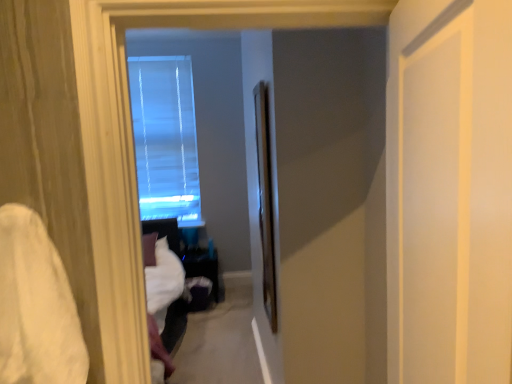
Question: Would you say white soft fabric at left is inside or outside clear glass screen door at center, acting as the 2th screen door starting from the right?

Choices:
 (A) outside
 (B) inside

Answer: (A)

Question: From a real-world perspective, is white soft fabric at left physically located above or below clear glass screen door at center, acting as the 2th screen door starting from the front?

Choices:
 (A) below
 (B) above

Answer: (A)

Question: Which is farther from the white soft fabric at left?

Choices:
 (A) white matte door at right, positioned as the second screen door in back-to-front order
 (B) clear glass screen door at center, the first screen door positioned from the back
 (C) transparent glass window at center

Answer: (C)

Question: Which object is positioned farthest from the transparent glass window at center?

Choices:
 (A) white matte door at right, positioned as the second screen door in back-to-front order
 (B) clear glass screen door at center, which ranks as the first screen door in left-to-right order
 (C) white soft fabric at left

Answer: (A)